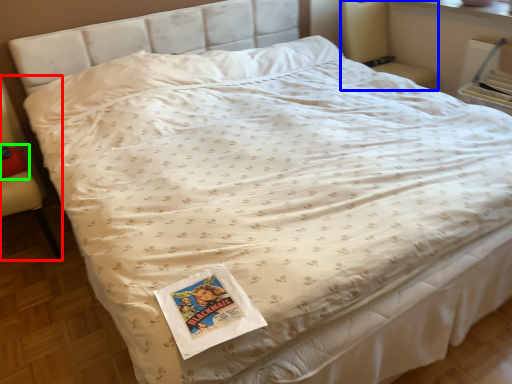
Question: Considering the real-world distances, which object is farthest from armchair (highlighted by a red box)? armchair (highlighted by a blue box) or pillow (highlighted by a green box)?

Choices:
 (A) armchair
 (B) pillow

Answer: (A)